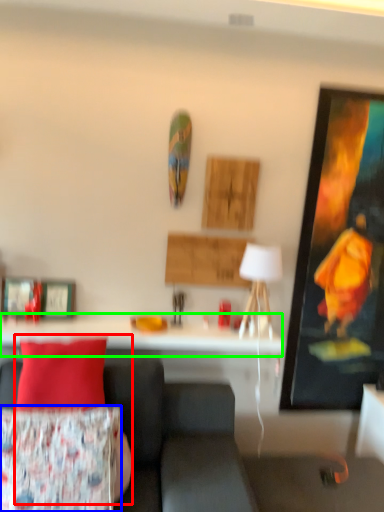
Question: Estimate the real-world distances between objects in this image. Which object is farther from person (highlighted by a red box), pillow (highlighted by a blue box) or table (highlighted by a green box)?

Choices:
 (A) pillow
 (B) table

Answer: (B)